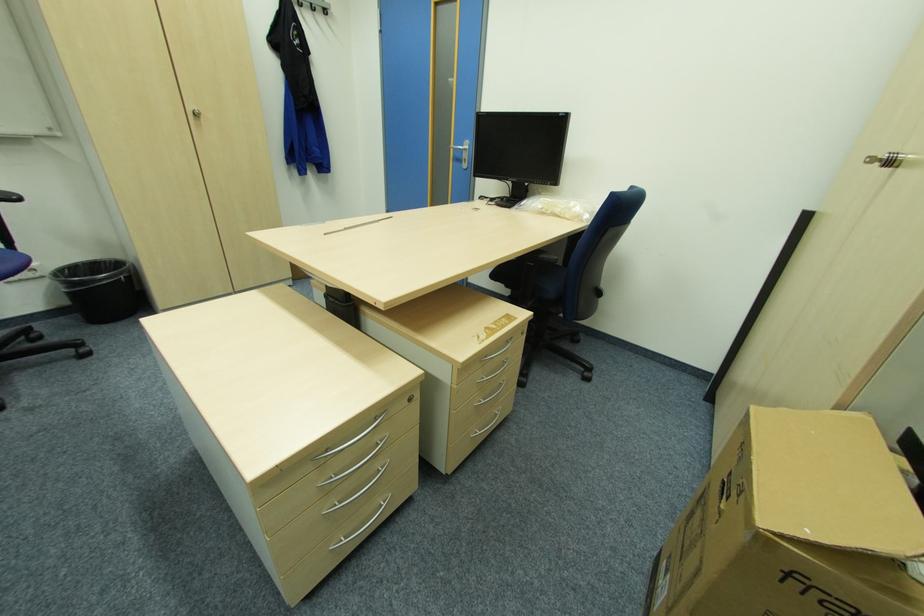
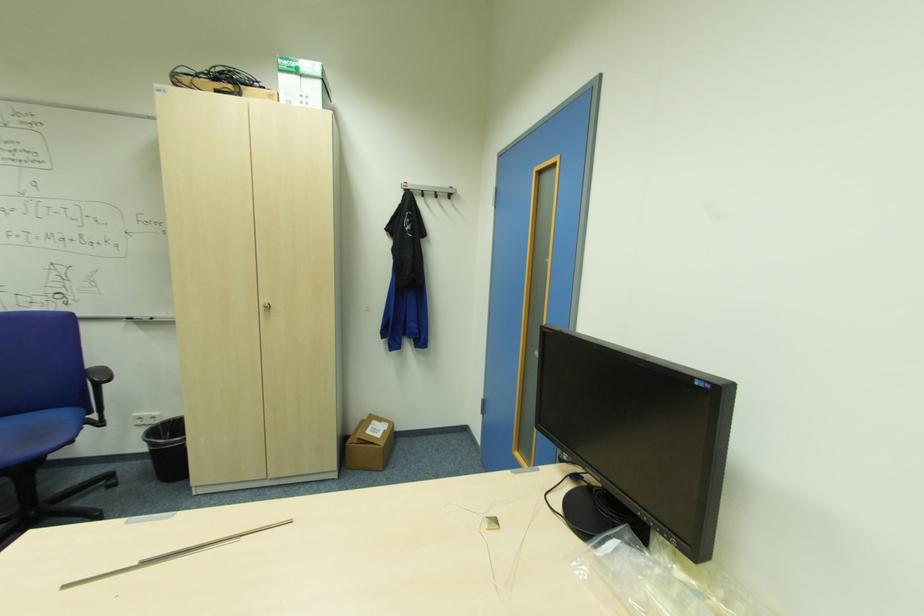
Find the pixel in the second image that matches [329,233] in the first image.

(63, 589)